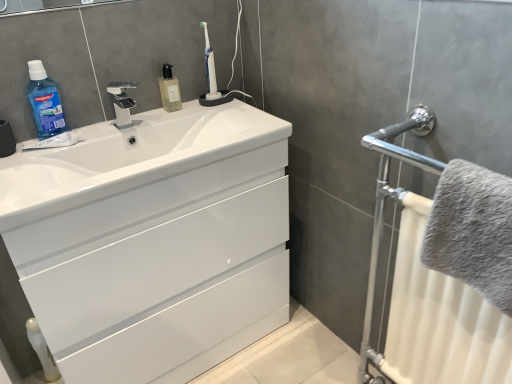
What are the coordinates of `free space in front of polished chrome tap at upper center` in the screenshot? It's located at (105, 128).